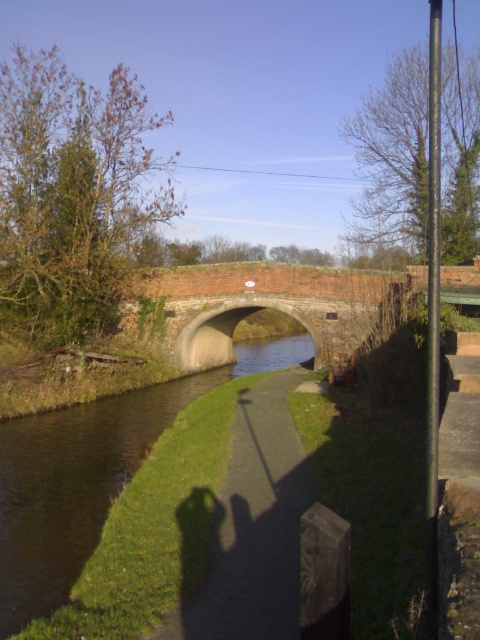
You are standing at the point with coordinates point (372, 316) and want to walk to the point with coordinates point (27, 598). According to the scene, which direction should you move to reach your destination?

You should move forward because point (27, 598) is in front of point (372, 316).

You are standing on the brick bridge and want to locate the dark green water at center. According to the coordinates given, where should you look relative to the bridge?

The dark green water at center is located at coordinates point [86,476], so you should look towards the lower right direction from the bridge to find it.